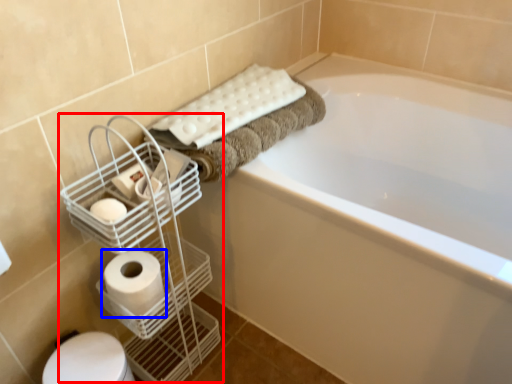
Question: Which object is closer to the camera taking this photo, bird cage (highlighted by a red box) or toilet paper (highlighted by a blue box)?

Choices:
 (A) bird cage
 (B) toilet paper

Answer: (A)